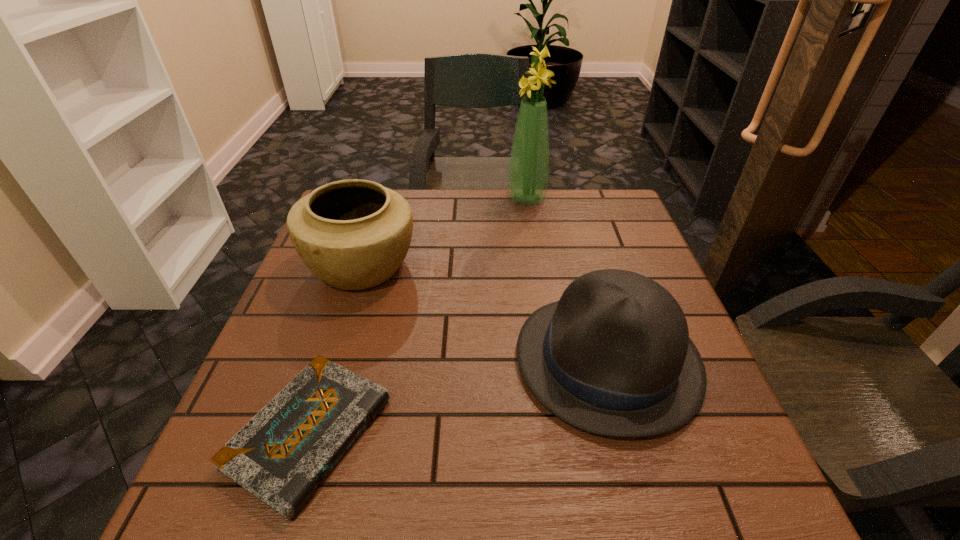
Find the location of a particular element. This screenshot has width=960, height=540. object located at the near left corner is located at coordinates (283, 453).

The width and height of the screenshot is (960, 540). Find the location of `vacant space at the far edge`. vacant space at the far edge is located at coordinates (400, 191).

Where is `vacant region at the near edge of the desktop`? The width and height of the screenshot is (960, 540). vacant region at the near edge of the desktop is located at coordinates (655, 505).

The width and height of the screenshot is (960, 540). In order to click on vacant region at the left edge in this screenshot , I will do `click(306, 356)`.

The height and width of the screenshot is (540, 960). I want to click on free point at the right edge, so click(642, 239).

Identify the location of free spot at the near left corner of the desktop. This screenshot has width=960, height=540. (239, 511).

At what (x,y) coordinates should I click in order to perform the action: click on vacant space at the far right corner of the desktop. Please return your answer as a coordinate pair (x, y). Looking at the image, I should click on (594, 201).

Where is `vacant point at the near right corner`? vacant point at the near right corner is located at coordinates (768, 523).

You are a GUI agent. You are given a task and a screenshot of the screen. Output one action in this format:
    pyautogui.click(x=<x>, y=<y>)
    Task: Click on the free space between the bowler hat and the pottery
    The height and width of the screenshot is (540, 960).
    Given the screenshot: What is the action you would take?
    pyautogui.click(x=485, y=313)

Where is `vacant space in between the notebook and the tallest object`? The width and height of the screenshot is (960, 540). vacant space in between the notebook and the tallest object is located at coordinates (418, 315).